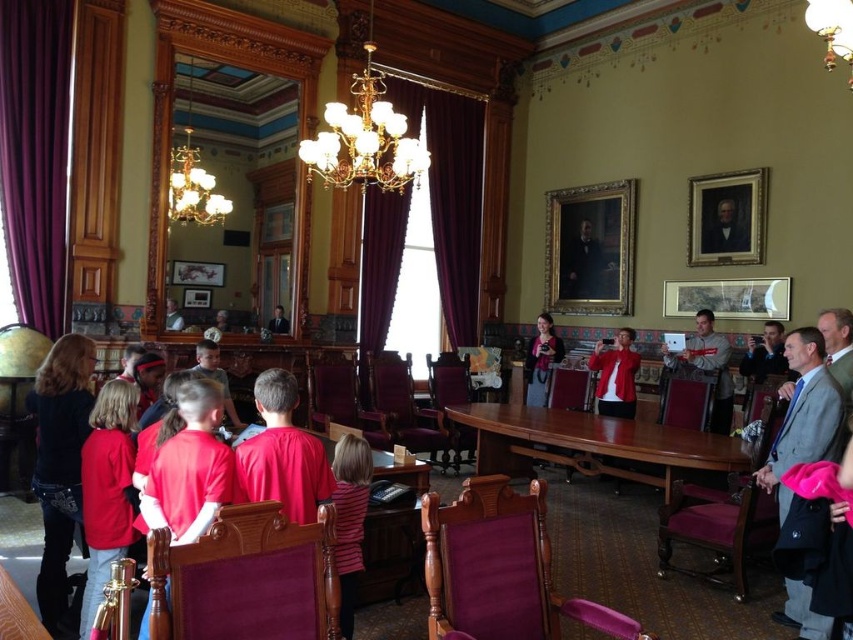
Question: Among these objects, which one is farthest from the camera?

Choices:
 (A) striped fabric shirt at lower center
 (B) matte red shirt at center
 (C) gold metallic chandelier at upper center

Answer: (C)

Question: Which of the following is the closest to the observer?

Choices:
 (A) (364, 157)
 (B) (100, 506)

Answer: (B)

Question: Can you confirm if gold metallic chandelier at upper center is wider than matte red shirt at center?

Choices:
 (A) yes
 (B) no

Answer: (A)

Question: Can you confirm if gold metallic chandelier at upper center is smaller than striped fabric shirt at lower center?

Choices:
 (A) no
 (B) yes

Answer: (A)

Question: Estimate the real-world distances between objects in this image. Which object is farther from the gold metallic chandelier at upper center?

Choices:
 (A) striped fabric shirt at lower center
 (B) matte red shirt at center

Answer: (A)

Question: Is gold metallic chandelier at upper center below matte red shirt at center?

Choices:
 (A) yes
 (B) no

Answer: (B)